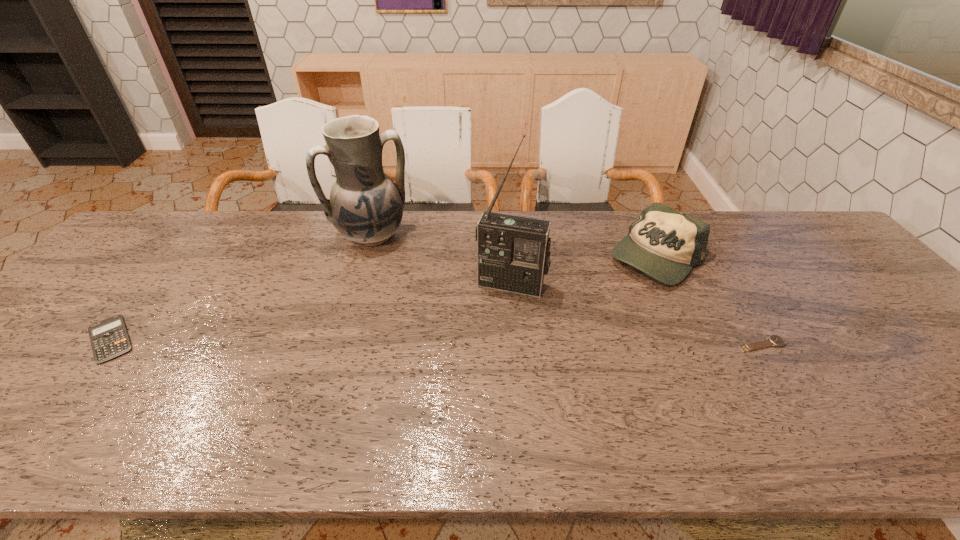
This screenshot has height=540, width=960. In order to click on free spot on the desktop that is between the leftmost object and the watch and is positioned on the front-facing side of the baseball cap in this screenshot , I will do `click(519, 342)`.

Where is `vacant space on the desktop that is between the calculator and the watch and is positioned on the display of the third object from left to right`? This screenshot has width=960, height=540. vacant space on the desktop that is between the calculator and the watch and is positioned on the display of the third object from left to right is located at coordinates pyautogui.click(x=492, y=342).

The image size is (960, 540). I want to click on vacant space on the desktop that is between the leftmost object and the watch and is positioned on the front-facing side of the fourth shortest object, so click(x=441, y=342).